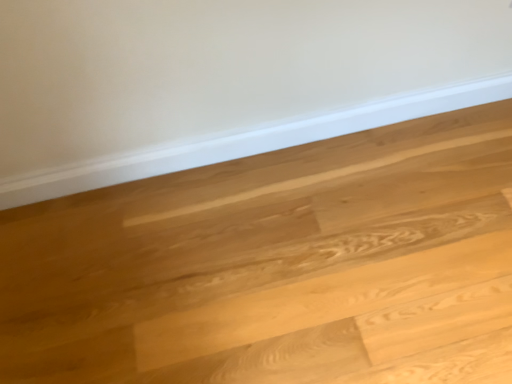
The height and width of the screenshot is (384, 512). What do you see at coordinates (277, 266) in the screenshot? I see `natural wood stairs at center` at bounding box center [277, 266].

Locate an element on the screen. natural wood stairs at center is located at coordinates (277, 266).

This screenshot has width=512, height=384. I want to click on natural wood stairs at center, so click(x=277, y=266).